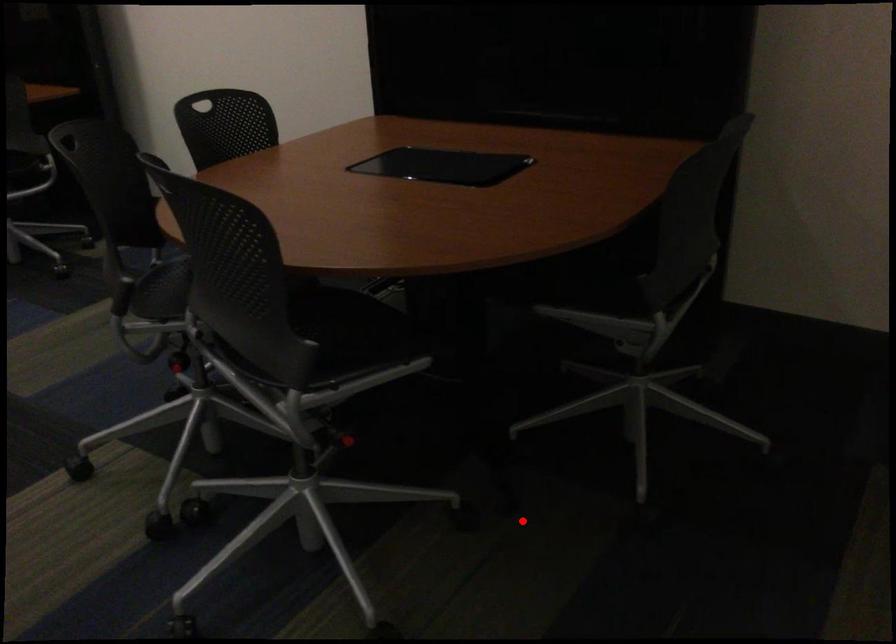
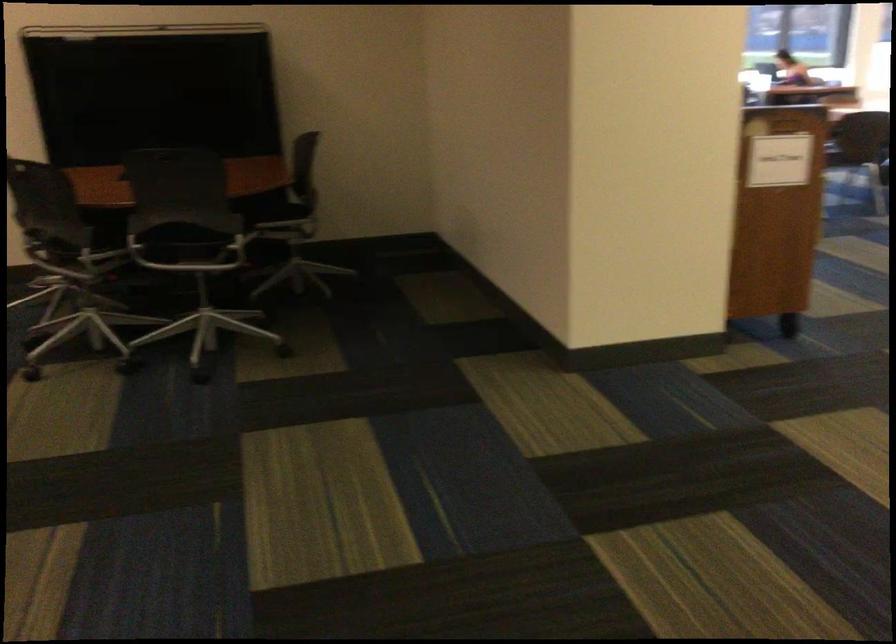
Question: I am providing you with two images of the same scene from different viewpoints. A red point is shown in image1. For the corresponding object point in image2, is it positioned nearer or farther from the camera?

Choices:
 (A) Nearer
 (B) Farther

Answer: (B)